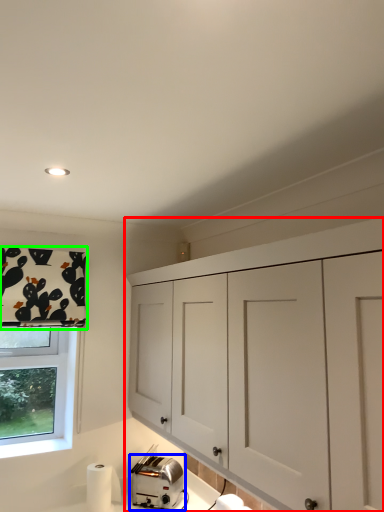
Question: Which is nearer to the cabinetry (highlighted by a red box)? toaster (highlighted by a blue box) or curtain (highlighted by a green box).

Choices:
 (A) toaster
 (B) curtain

Answer: (A)